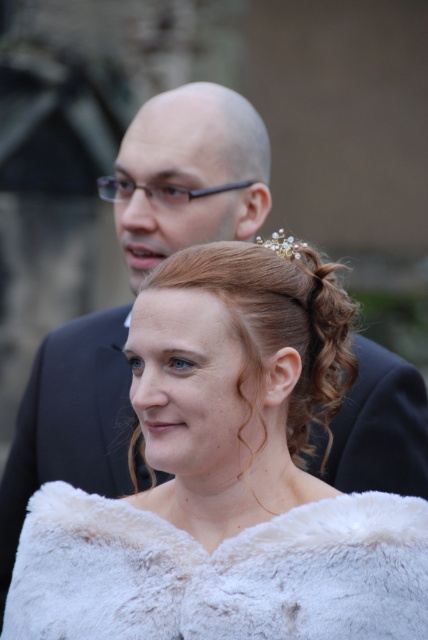
Is white fur coat at center taller than curly blonde hair at center?

Yes.

What do you see at coordinates (226, 477) in the screenshot? I see `white fur coat at center` at bounding box center [226, 477].

Does point (312, 561) come in front of point (326, 406)?

Yes, it is in front of point (326, 406).

Find the location of `white fur coat at center`. white fur coat at center is located at coordinates (226, 477).

At what (x,y) coordinates should I click in order to perform the action: click on curly blonde hair at center. Please return your answer as a coordinate pair (x, y). Looking at the image, I should click on (276, 328).

In the scene shown: Who is more forward, (x=285, y=282) or (x=288, y=253)?

Point (x=285, y=282)

What do you see at coordinates (276, 328) in the screenshot? I see `curly blonde hair at center` at bounding box center [276, 328].

The height and width of the screenshot is (640, 428). Find the location of `curly blonde hair at center`. curly blonde hair at center is located at coordinates (276, 328).

Is white fur coat at center positioned in front of white fur coat at lower center?

No, it is behind white fur coat at lower center.

Is white fur coat at center below white fur coat at lower center?

No, white fur coat at center is not below white fur coat at lower center.

The width and height of the screenshot is (428, 640). Identify the location of white fur coat at center. (226, 477).

Locate an element on the screen. The image size is (428, 640). white fur coat at center is located at coordinates [x=226, y=477].